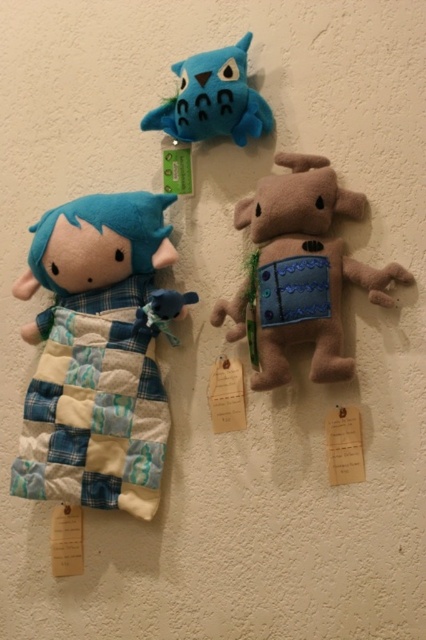
Question: Which of the following is the farthest from the observer?

Choices:
 (A) (120, 259)
 (B) (204, 124)
 (C) (317, 227)

Answer: (B)

Question: Can you confirm if patchwork fabric doll at left is positioned above matte blue plush owl at upper center?

Choices:
 (A) yes
 (B) no

Answer: (B)

Question: Does patchwork fabric doll at left have a larger size compared to brown plush dog at center?

Choices:
 (A) yes
 (B) no

Answer: (A)

Question: Which of the following is the closest to the observer?

Choices:
 (A) (252, 122)
 (B) (290, 184)

Answer: (B)

Question: Which point is farther to the camera?

Choices:
 (A) matte blue plush owl at upper center
 (B) brown plush dog at center

Answer: (A)

Question: Is patchwork fabric doll at left to the right of brown plush dog at center from the viewer's perspective?

Choices:
 (A) yes
 (B) no

Answer: (B)